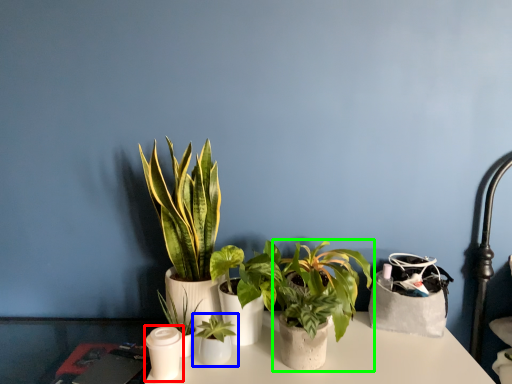
Question: Which object is positioned closest to candle holder (highlighted by a red box)? Select from houseplant (highlighted by a blue box) and houseplant (highlighted by a green box).

Choices:
 (A) houseplant
 (B) houseplant

Answer: (A)